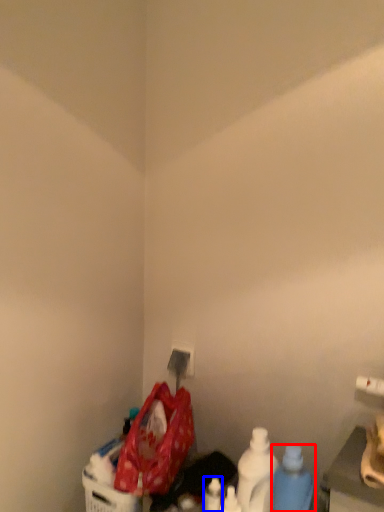
Question: Which point is closer to the camera, bottle (highlighted by a red box) or bottle (highlighted by a blue box)?

Choices:
 (A) bottle
 (B) bottle

Answer: (A)